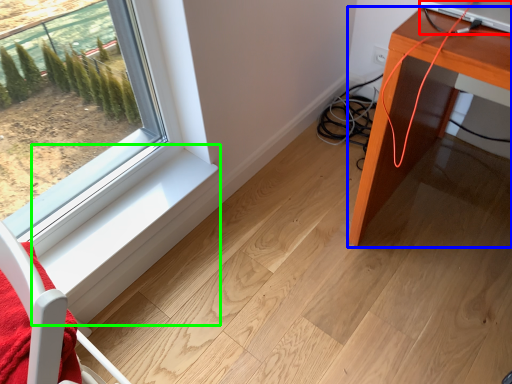
Question: Considering the real-world distances, which object is closest to desktop computer (highlighted by a red box)? table (highlighted by a blue box) or window sill (highlighted by a green box).

Choices:
 (A) table
 (B) window sill

Answer: (A)